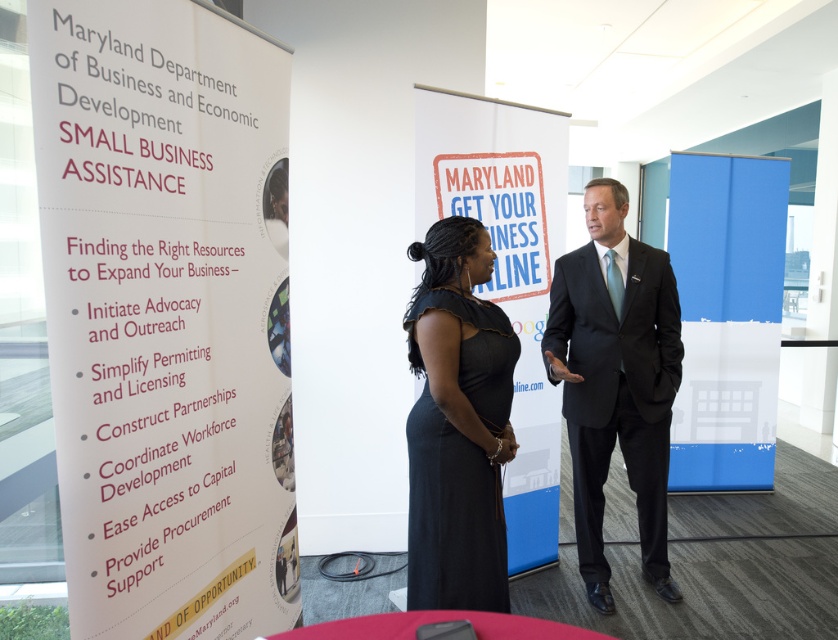
You are a photographer at a business event and need to capture a clear photo of the white paper at left and the black satin dress at center. The camera you are using has a shallow depth of field. Which object should you focus on to ensure both are in focus?

Since the white paper at left is in front of the black satin dress at center, focusing on the white paper at left would place the black satin dress at center further back. With a shallow depth of field, only the white paper at left would be in focus while the dress may be blurred. To get both in focus, you should focus on a point between them or use a smaller aperture for greater depth of field.

You are a conference attendee holding a white paper at left and need to hand it to a person in a black suit at center. Can you reach them without moving closer? The average arm length is 2.5 feet.

The distance between the white paper at left and the black suit at center is 4.89 feet. Since the average arm length is 2.5 feet, you cannot reach them without moving closer.

You are a participant at a conference and need to locate the white paper at left. Where should you look in the image?

The white paper at left is located at point 0.492 on the x axis and 0.200 on the y axis.